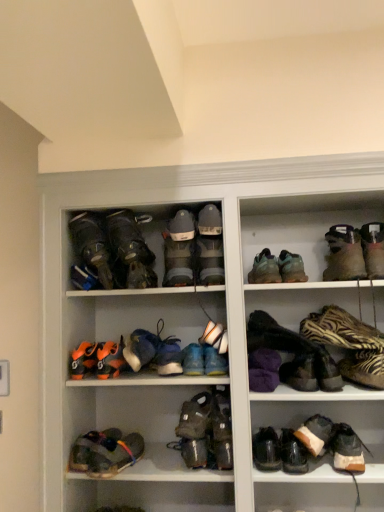
Question: Considering the relative sizes of leather hiking boots at upper left, which is counted as the 18th footwear, starting from the right, and purple fuzzy slippers at center, marked as the seventh footwear in a right-to-left arrangement, in the image provided, is leather hiking boots at upper left, which is counted as the 18th footwear, starting from the right, smaller than purple fuzzy slippers at center, marked as the seventh footwear in a right-to-left arrangement,?

Choices:
 (A) no
 (B) yes

Answer: (A)

Question: Is leather hiking boots at upper left, the 3th footwear positioned from the left, not close to purple fuzzy slippers at center, marked as the seventh footwear in a right-to-left arrangement?

Choices:
 (A) yes
 (B) no

Answer: (B)

Question: Can you confirm if leather hiking boots at upper left, the 3th footwear positioned from the left, is positioned to the right of purple fuzzy slippers at center, the fourteenth footwear when ordered from left to right?

Choices:
 (A) no
 (B) yes

Answer: (A)

Question: Does leather hiking boots at upper left, which is counted as the 18th footwear, starting from the right, contain purple fuzzy slippers at center, marked as the seventh footwear in a right-to-left arrangement?

Choices:
 (A) yes
 (B) no

Answer: (B)

Question: Considering the relative sizes of leather hiking boots at upper left, the 3th footwear positioned from the left, and purple fuzzy slippers at center, the fourteenth footwear when ordered from left to right, in the image provided, is leather hiking boots at upper left, the 3th footwear positioned from the left, taller than purple fuzzy slippers at center, the fourteenth footwear when ordered from left to right,?

Choices:
 (A) yes
 (B) no

Answer: (A)

Question: Is white fabric shoe at center, the tenth footwear positioned from the right, bigger or smaller than blue suede sneakers at center, marked as the fifteenth footwear in a right-to-left arrangement?

Choices:
 (A) small
 (B) big

Answer: (A)

Question: Looking at their shapes, would you say white fabric shoe at center, the eleventh footwear when ordered from left to right, is wider or thinner than blue suede sneakers at center, marked as the fifteenth footwear in a right-to-left arrangement?

Choices:
 (A) thin
 (B) wide

Answer: (A)

Question: Is white fabric shoe at center, the tenth footwear positioned from the right, to the left or to the right of blue suede sneakers at center, marked as the fifteenth footwear in a right-to-left arrangement, in the image?

Choices:
 (A) right
 (B) left

Answer: (A)

Question: Is white fabric shoe at center, the eleventh footwear when ordered from left to right, in front of or behind blue suede sneakers at center, which ranks as the sixth footwear in left-to-right order, in the image?

Choices:
 (A) behind
 (B) front

Answer: (B)

Question: Based on their positions, is orange mesh sneaker at lower center, the fourth footwear positioned from the left, located to the left or right of dark gray suede boots at center, arranged as the tenth footwear when viewed from the left?

Choices:
 (A) right
 (B) left

Answer: (B)

Question: From their relative heights in the image, would you say orange mesh sneaker at lower center, the fourth footwear positioned from the left, is taller or shorter than dark gray suede boots at center, the 11th footwear viewed from the right?

Choices:
 (A) tall
 (B) short

Answer: (B)

Question: Looking at the image, does orange mesh sneaker at lower center, the fourth footwear positioned from the left, seem bigger or smaller compared to dark gray suede boots at center, the 11th footwear viewed from the right?

Choices:
 (A) big
 (B) small

Answer: (B)

Question: Is orange mesh sneaker at lower center, which is counted as the 17th footwear, starting from the right, spatially inside dark gray suede boots at center, arranged as the tenth footwear when viewed from the left, or outside of it?

Choices:
 (A) inside
 (B) outside

Answer: (B)

Question: Relative to leather hiking boots at upper left, the 3th footwear positioned from the left, is orange mesh sneaker at lower center, the fourth footwear positioned from the left, in front or behind?

Choices:
 (A) behind
 (B) front

Answer: (A)

Question: Is point (102, 364) positioned closer to the camera than point (102, 233)?

Choices:
 (A) closer
 (B) farther

Answer: (A)